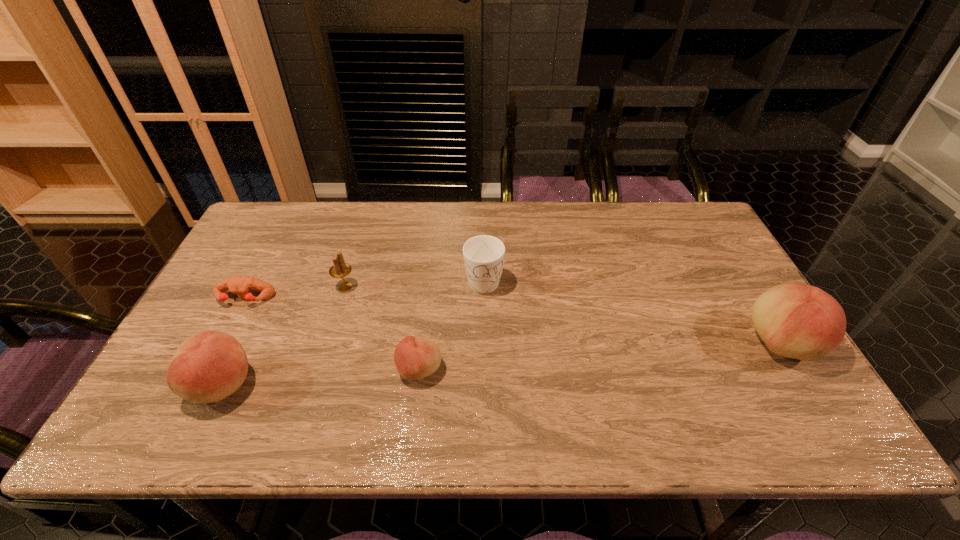
You are a GUI agent. You are given a task and a screenshot of the screen. Output one action in this format:
    pyautogui.click(x=<x>, y=<y>)
    Task: Click on the second shortest peach
    The height and width of the screenshot is (540, 960).
    Given the screenshot: What is the action you would take?
    pyautogui.click(x=209, y=366)

This screenshot has width=960, height=540. Find the location of `the shortest peach`. the shortest peach is located at coordinates (415, 358).

Locate an element on the screen. The image size is (960, 540). the fourth object from left to right is located at coordinates (415, 358).

Locate an element on the screen. the rightmost peach is located at coordinates (800, 321).

Identify the location of the second object from right to left. (483, 255).

Where is `puncher`? The width and height of the screenshot is (960, 540). puncher is located at coordinates (241, 286).

Locate an element on the screen. The height and width of the screenshot is (540, 960). candle holder is located at coordinates coord(340,269).

Where is `free space located 0.080m on the left of the second shortest peach`? free space located 0.080m on the left of the second shortest peach is located at coordinates (156, 384).

Identify the location of free spot located 0.150m on the left of the second peach from right to left. (335, 370).

Identify the location of vacant space situated on the left of the rightmost object. The image size is (960, 540). (711, 343).